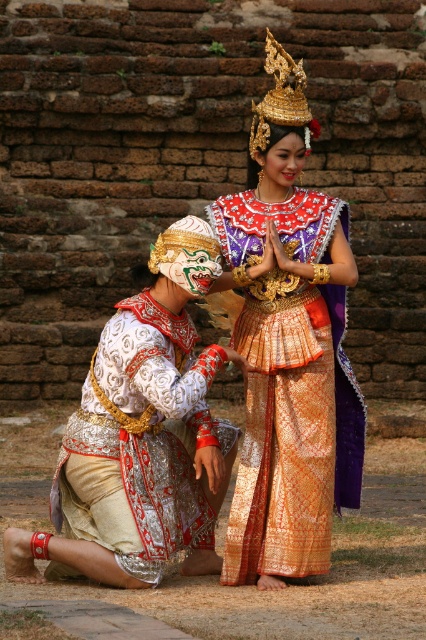
You are a photographer setting up a shoot in this scene. You need to ensure that the gold brocade dress at center and the white embroidered fabric at lower left are both visible in the frame. Based on their positions, which object is covering part of the other?

The gold brocade dress at center is positioned over the white embroidered fabric at lower left, so it is covering part of it.

You are a photographer setting up for a cultural performance. You need to position a spotlight so it illuminates both the gold brocade dress at center and the white embroidered fabric at lower left without casting shadows over the brick wall. Considering their positions, which object should be closer to the spotlight to avoid shadowing the wall?

The white embroidered fabric at lower left is behind the gold brocade dress at center, so to avoid casting shadows on the wall, the spotlight should be positioned closer to the gold brocade dress at center. This way, the fabric behind it will not cast a shadow beyond the dress onto the wall.

You are a photographer adjusting your camera settings to focus on two specific points in the scene. The points are labeled as point (x=245, y=531) and point (x=117, y=422). Which point is closer to the camera?

Point (x=117, y=422) is closer to the camera because the description states that point (x=245, y=531) is further away.